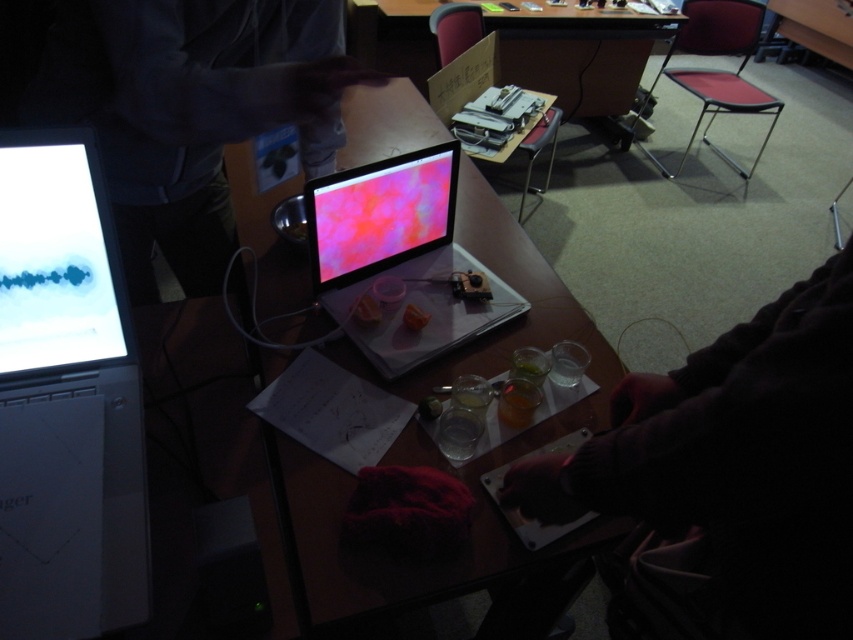
Does matte plastic laptop at center appear over wooden desk at center?

No, matte plastic laptop at center is not above wooden desk at center.

Is point (412, 266) behind point (364, 13)?

No, (412, 266) is closer to viewer.

Find the location of a particular element. matte plastic laptop at center is located at coordinates (399, 259).

At what (x,y) coordinates should I click in order to perform the action: click on matte plastic laptop at center. Please return your answer as a coordinate pair (x, y). Looking at the image, I should click on (399, 259).

Does matte plastic laptop at center appear on the right side of matte plastic monitor at center?

Correct, you'll find matte plastic laptop at center to the right of matte plastic monitor at center.

Which is below, matte plastic laptop at center or matte plastic monitor at center?

matte plastic laptop at center is below.

Which is in front, point (405, 358) or point (323, 244)?

Point (405, 358)

Find the location of a particular element. The height and width of the screenshot is (640, 853). matte plastic laptop at center is located at coordinates (399, 259).

Which is behind, point (747, 595) or point (310, 252)?

Point (310, 252)

Is dark wool sweater at lower right wider than matte plastic monitor at center?

Yes.

Locate an element on the screen. This screenshot has width=853, height=640. dark wool sweater at lower right is located at coordinates (727, 477).